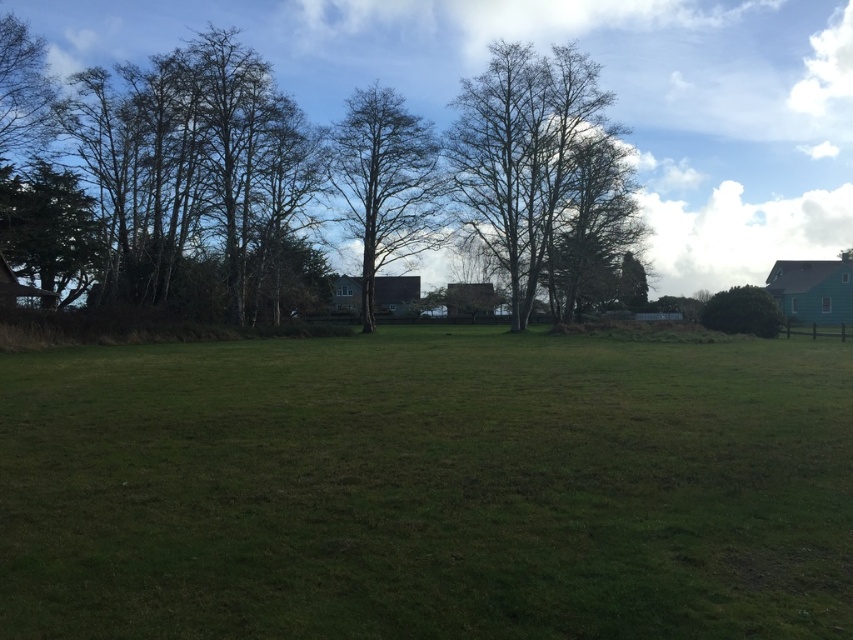
You are planning to install a small garden path between the green grass at center and the green leafy bush at right. Considering their widths, which area would require more space for the path?

The green grass at center has a greater width than the green leafy bush at right, so the path between them would require more space if aligned with the grass area.

You are standing at the point with coordinates point (753, 320) and want to walk towards the point with coordinates point (849, 604). Based on the scene description, will you have an unobstructed path to reach the destination?

Yes, you will have an unobstructed path to reach point (849, 604) because it is in front of point (753, 320), meaning there are no objects blocking the way between them according to the scene description.